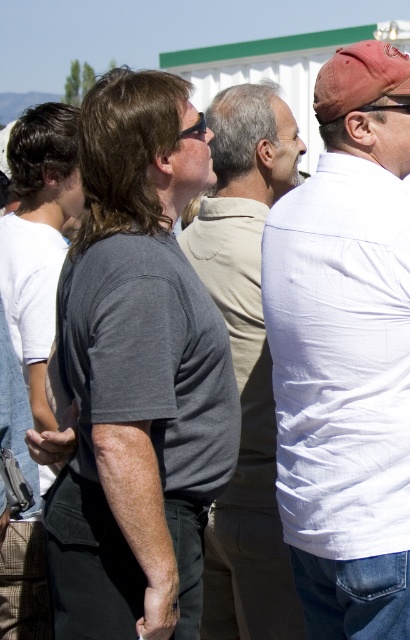
Question: Does white cotton shirt at right have a greater width compared to gray cotton shirt at center?

Choices:
 (A) no
 (B) yes

Answer: (A)

Question: Among these points, which one is nearest to the camera?

Choices:
 (A) (389, 348)
 (B) (213, 278)

Answer: (A)

Question: Does white cotton shirt at right appear under gray cotton shirt at center?

Choices:
 (A) no
 (B) yes

Answer: (A)

Question: Which object is closer to the camera taking this photo?

Choices:
 (A) gray cotton shirt at center
 (B) white cotton shirt at right

Answer: (B)

Question: Is white cotton shirt at right behind gray cotton shirt at center?

Choices:
 (A) yes
 (B) no

Answer: (B)

Question: Which point is farther to the camera?

Choices:
 (A) (316, 518)
 (B) (250, 540)

Answer: (B)